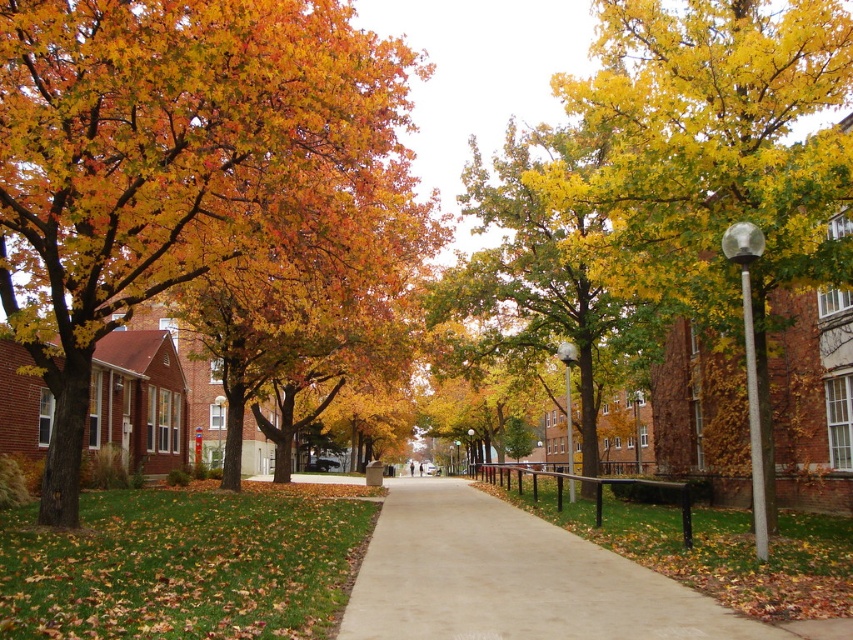
You are standing on the pathway in the autumn scene and want to take a photo of the orange leafy tree at left. If your camera has a maximum focus range of 25 feet, will you need to move closer to capture it clearly?

The orange leafy tree at left is 28.15 feet away from the viewer, which exceeds the camera maximum focus range of 25 feet. You need to move closer to ensure the tree is within the 25 feet range for clear focus.